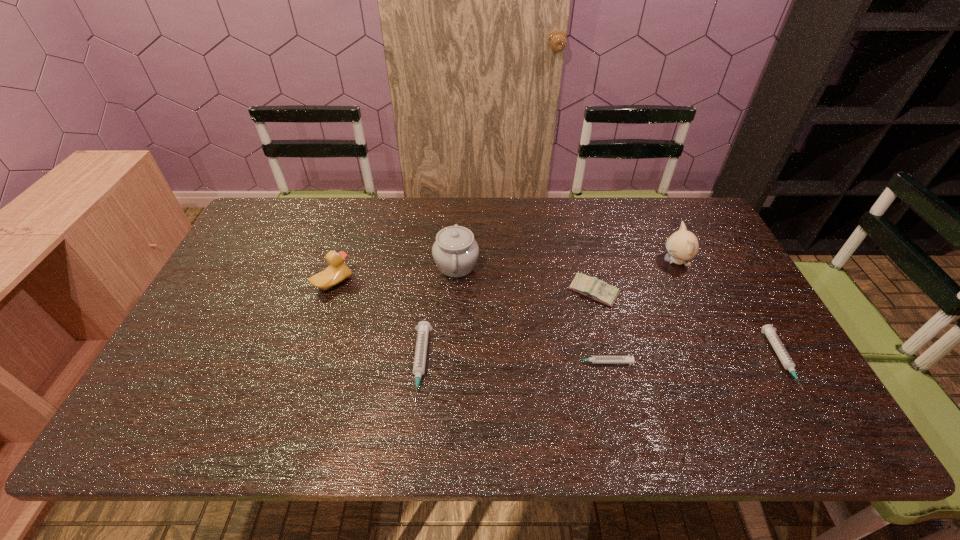
Locate an element on the screen. This screenshot has height=540, width=960. the fifth tallest object is located at coordinates (423, 327).

Image resolution: width=960 pixels, height=540 pixels. What are the coordinates of `the tallest syringe` in the screenshot? It's located at (423, 327).

Find the location of a particular element. This screenshot has width=960, height=540. the shortest syringe is located at coordinates (594, 359).

The image size is (960, 540). I want to click on the second syringe from left to right, so click(594, 359).

The height and width of the screenshot is (540, 960). In order to click on the second shortest syringe in this screenshot , I will do `click(768, 330)`.

The width and height of the screenshot is (960, 540). What are the coordinates of `the second shortest object` in the screenshot? It's located at (768, 330).

Where is `chinaware`? Image resolution: width=960 pixels, height=540 pixels. chinaware is located at coordinates (455, 252).

Find the location of a particular element. Image resolution: width=960 pixels, height=540 pixels. diary is located at coordinates (598, 290).

Locate an element on the screen. This screenshot has height=540, width=960. the third tallest object is located at coordinates (337, 271).

The image size is (960, 540). I want to click on duck, so click(337, 271).